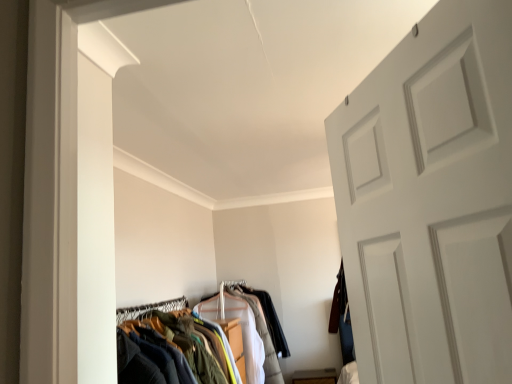
Question: Choose the correct answer: Is white cotton shirt at center inside textured fabric clothes at center or outside it?

Choices:
 (A) inside
 (B) outside

Answer: (B)

Question: From a real-world perspective, is white cotton shirt at center physically located above or below textured fabric clothes at center?

Choices:
 (A) above
 (B) below

Answer: (B)

Question: Considering their positions, is white cotton shirt at center located in front of or behind textured fabric clothes at center?

Choices:
 (A) behind
 (B) front

Answer: (A)

Question: From a real-world perspective, is textured fabric clothes at center above or below white cotton shirt at center?

Choices:
 (A) above
 (B) below

Answer: (A)

Question: Is textured fabric clothes at center spatially inside white cotton shirt at center, or outside of it?

Choices:
 (A) outside
 (B) inside

Answer: (A)

Question: Is textured fabric clothes at center in front of or behind white cotton shirt at center in the image?

Choices:
 (A) front
 (B) behind

Answer: (A)

Question: Is point (162, 304) positioned closer to the camera than point (258, 362)?

Choices:
 (A) closer
 (B) farther

Answer: (A)